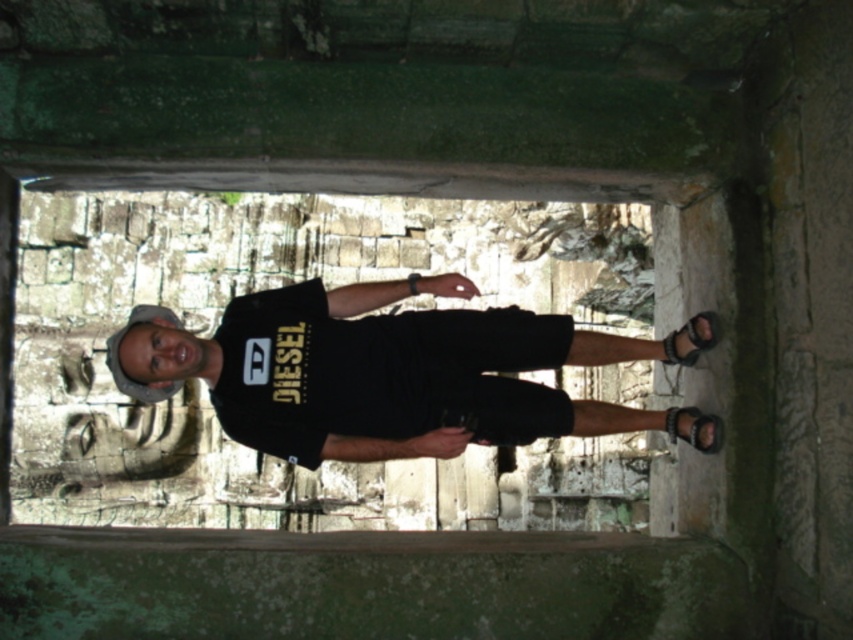
Question: In this image, where is black leather sandal at right located relative to black leather sandal at lower right?

Choices:
 (A) above
 (B) below

Answer: (A)

Question: In this image, where is black matte t-shirt at center located relative to black leather sandal at lower right?

Choices:
 (A) right
 (B) left

Answer: (B)

Question: Which point is closer to the camera?

Choices:
 (A) black matte t-shirt at center
 (B) black leather sandal at right
 (C) black leather sandal at lower right

Answer: (C)

Question: Is black leather sandal at right positioned before black leather sandal at lower right?

Choices:
 (A) no
 (B) yes

Answer: (A)

Question: Which of the following is the closest to the observer?

Choices:
 (A) black leather sandal at lower right
 (B) black leather sandal at right

Answer: (A)

Question: Estimate the real-world distances between objects in this image. Which object is closer to the black leather sandal at lower right?

Choices:
 (A) black leather sandal at right
 (B) black matte t-shirt at center

Answer: (A)